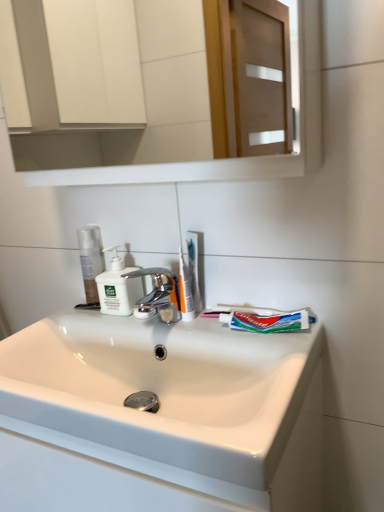
Locate an element on the screen. free spot in front of translucent plastic toothbrush at center is located at coordinates (220, 344).